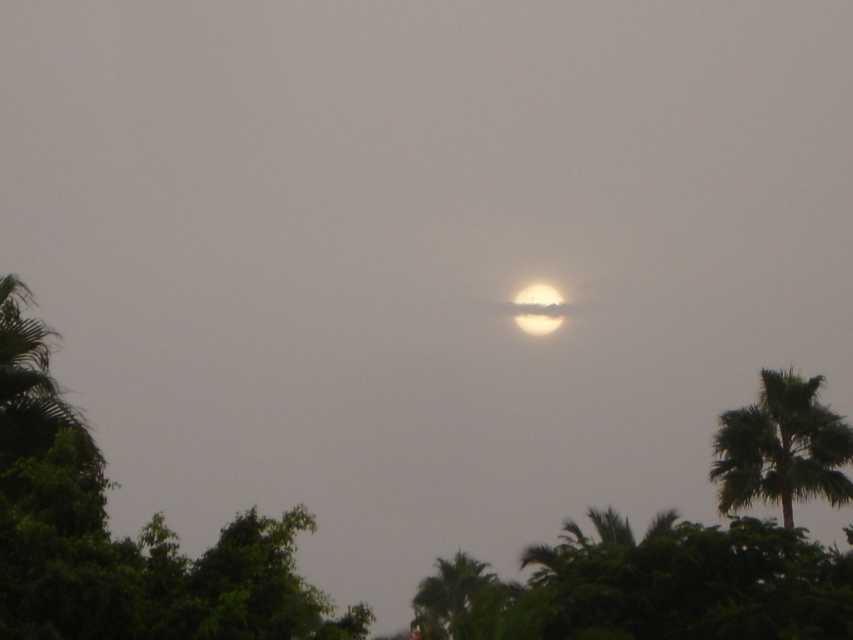
Based on the photo, is green leafy palm tree at lower center below matte yellow moon at center?

Indeed, green leafy palm tree at lower center is positioned under matte yellow moon at center.

Is green leafy palm tree at lower center thinner than matte yellow moon at center?

In fact, green leafy palm tree at lower center might be wider than matte yellow moon at center.

The height and width of the screenshot is (640, 853). Describe the element at coordinates (450, 595) in the screenshot. I see `green leafy palm tree at lower center` at that location.

Find the location of a particular element. The height and width of the screenshot is (640, 853). green leafy palm tree at lower center is located at coordinates (450, 595).

The height and width of the screenshot is (640, 853). Describe the element at coordinates (450, 595) in the screenshot. I see `green leafy palm tree at lower center` at that location.

Can you confirm if green leafy palm tree at lower center is shorter than fuzzy white sun at center?

No.

Describe the element at coordinates (450, 595) in the screenshot. I see `green leafy palm tree at lower center` at that location.

What are the coordinates of `green leafy palm tree at lower center` in the screenshot? It's located at (450, 595).

Does green leafy palm tree at right have a larger size compared to green leafy palm tree at lower center?

Actually, green leafy palm tree at right might be smaller than green leafy palm tree at lower center.

Measure the distance between point (x=798, y=448) and camera.

The distance of point (x=798, y=448) from camera is 44.39 meters.

Is point (824, 436) behind point (462, 560)?

That is False.

Locate an element on the screen. green leafy palm tree at right is located at coordinates [x=781, y=449].